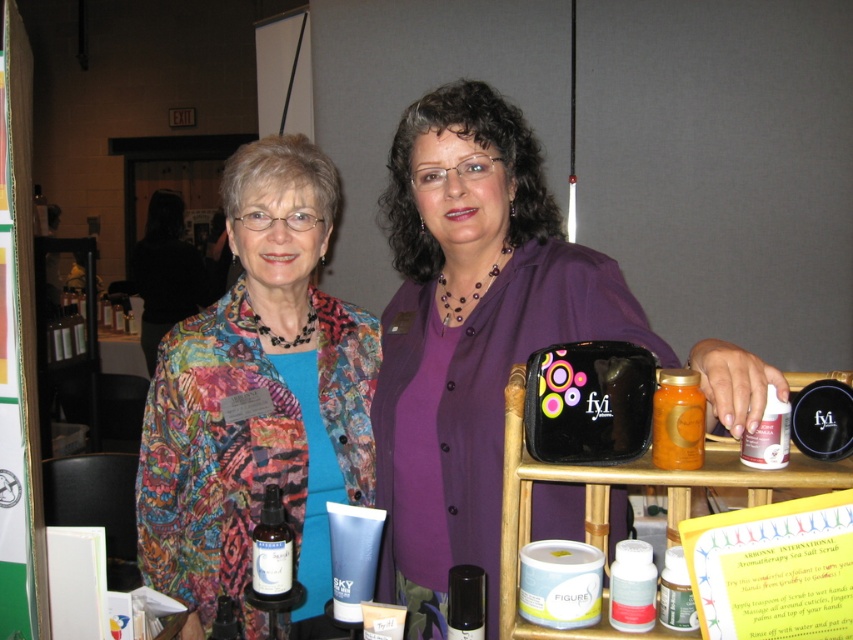
Question: Does purple matte shirt at center appear on the right side of translucent glass spray bottle at center?

Choices:
 (A) yes
 (B) no

Answer: (A)

Question: Which object is closer to the camera taking this photo?

Choices:
 (A) translucent glass spray bottle at center
 (B) purple matte shirt at center

Answer: (B)

Question: In this image, where is purple matte shirt at center located relative to multicolored fabric jacket at center?

Choices:
 (A) above
 (B) below

Answer: (A)

Question: Which point is farther to the camera?

Choices:
 (A) (498, 221)
 (B) (274, 570)

Answer: (A)

Question: Which point is closer to the camera?

Choices:
 (A) (267, 532)
 (B) (323, 470)

Answer: (A)

Question: Is multicolored fabric jacket at center bigger than translucent glass spray bottle at center?

Choices:
 (A) no
 (B) yes

Answer: (B)